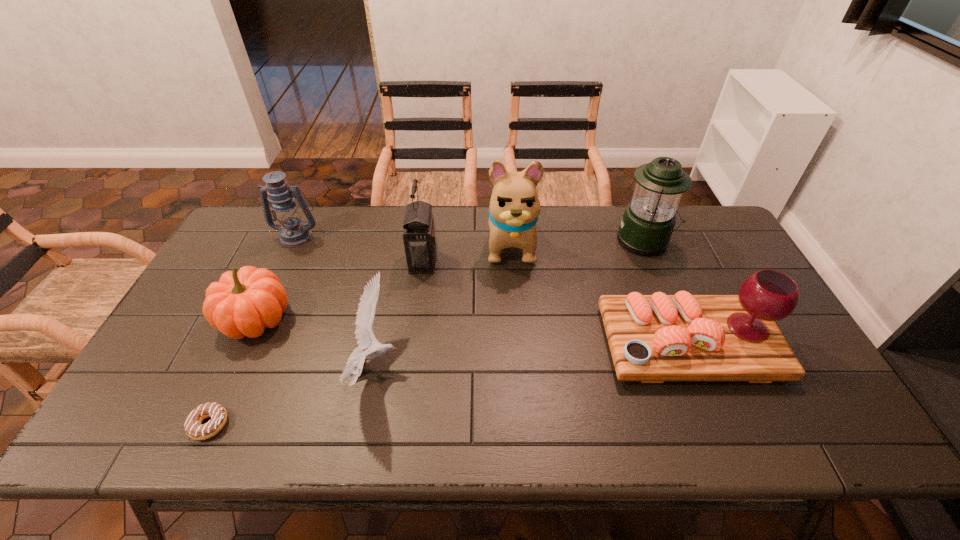
The image size is (960, 540). I want to click on free space between the gull and the shortest object, so click(x=292, y=395).

The height and width of the screenshot is (540, 960). Identify the location of empty location between the second lantern from left to right and the platter. (556, 302).

The width and height of the screenshot is (960, 540). In order to click on vacant region between the pumpkin and the second lantern from right to left in this screenshot , I will do `click(339, 290)`.

The height and width of the screenshot is (540, 960). Find the location of `free area in between the rightmost lantern and the pumpkin`. free area in between the rightmost lantern and the pumpkin is located at coordinates (450, 280).

The width and height of the screenshot is (960, 540). Identify the location of free point between the rightmost lantern and the platter. (667, 292).

I want to click on the fifth closest object relative to the sixth object from left to right, so click(x=243, y=303).

Image resolution: width=960 pixels, height=540 pixels. Identify the location of the fourth closest object to the platter. (365, 337).

Locate which lantern is the closest to the second lantern from left to right. Please provide its 2D coordinates. Your answer should be formatted as a tuple, i.e. [(x, y)], where the tuple contains the x and y coordinates of a point satisfying the conditions above.

[(293, 232)]

Locate which lantern ranks in proximity to the rightmost lantern. Please provide its 2D coordinates. Your answer should be formatted as a tuple, i.e. [(x, y)], where the tuple contains the x and y coordinates of a point satisfying the conditions above.

[(419, 235)]

Find the location of `vacant space that satisfies the following two spatial constraints: 1. on the face of the puppy; 2. on the left side of the platter`. vacant space that satisfies the following two spatial constraints: 1. on the face of the puppy; 2. on the left side of the platter is located at coordinates (518, 343).